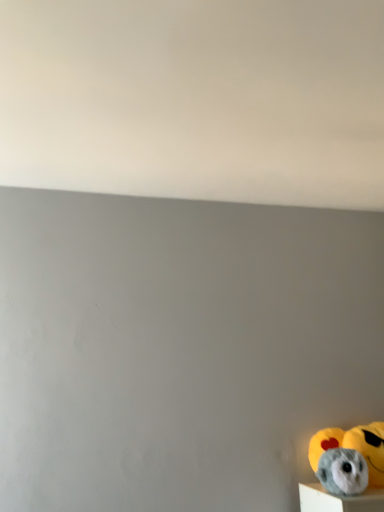
Question: Considering the relative positions of fluffy gray plush toy at lower right and fluffy gray plush toy at lower right in the image provided, is fluffy gray plush toy at lower right behind fluffy gray plush toy at lower right?

Choices:
 (A) no
 (B) yes

Answer: (B)

Question: From a real-world perspective, is fluffy gray plush toy at lower right over fluffy gray plush toy at lower right?

Choices:
 (A) no
 (B) yes

Answer: (B)

Question: Is fluffy gray plush toy at lower right at the right side of fluffy gray plush toy at lower right?

Choices:
 (A) yes
 (B) no

Answer: (A)

Question: Does fluffy gray plush toy at lower right have a greater height compared to fluffy gray plush toy at lower right?

Choices:
 (A) no
 (B) yes

Answer: (B)

Question: Does fluffy gray plush toy at lower right come in front of fluffy gray plush toy at lower right?

Choices:
 (A) yes
 (B) no

Answer: (B)

Question: Is fluffy gray plush toy at lower right at the back of fluffy gray plush toy at lower right?

Choices:
 (A) no
 (B) yes

Answer: (A)

Question: From the image's perspective, is fluffy gray plush toy at lower right over fluffy gray plush toy at lower right?

Choices:
 (A) no
 (B) yes

Answer: (B)

Question: Is fluffy gray plush toy at lower right further to the viewer compared to fluffy gray plush toy at lower right?

Choices:
 (A) yes
 (B) no

Answer: (B)

Question: Is fluffy gray plush toy at lower right to the left of fluffy gray plush toy at lower right from the viewer's perspective?

Choices:
 (A) yes
 (B) no

Answer: (A)

Question: From a real-world perspective, is fluffy gray plush toy at lower right on top of fluffy gray plush toy at lower right?

Choices:
 (A) no
 (B) yes

Answer: (A)

Question: Considering the relative sizes of fluffy gray plush toy at lower right and fluffy gray plush toy at lower right in the image provided, is fluffy gray plush toy at lower right shorter than fluffy gray plush toy at lower right?

Choices:
 (A) no
 (B) yes

Answer: (B)

Question: From the image's perspective, is fluffy gray plush toy at lower right under fluffy gray plush toy at lower right?

Choices:
 (A) no
 (B) yes

Answer: (A)

Question: Is point (359, 465) closer or farther from the camera than point (349, 433)?

Choices:
 (A) closer
 (B) farther

Answer: (A)